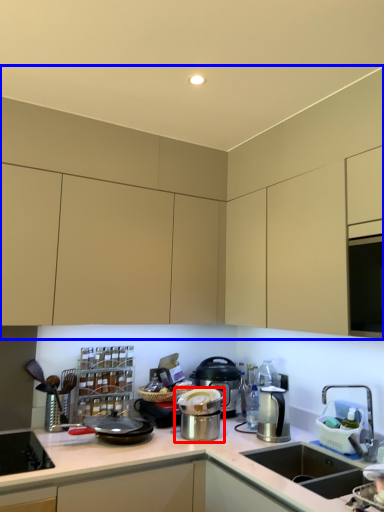
Question: Among these objects, which one is nearest to the camera, kitchen appliance (highlighted by a red box) or cabinetry (highlighted by a blue box)?

Choices:
 (A) kitchen appliance
 (B) cabinetry

Answer: (B)